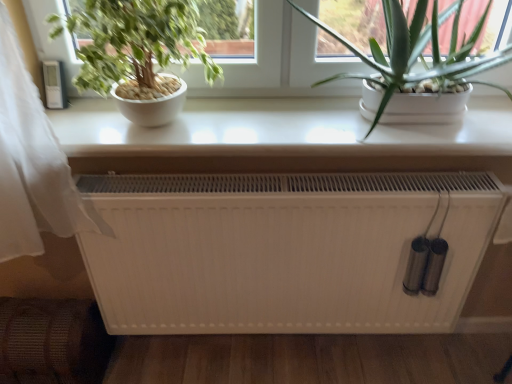
Locate an element on the screen. free space between green leafy plant at upper right, acting as the first houseplant starting from the right, and green matte plant at left, which appears as the first houseplant when viewed from the left is located at coordinates (252, 128).